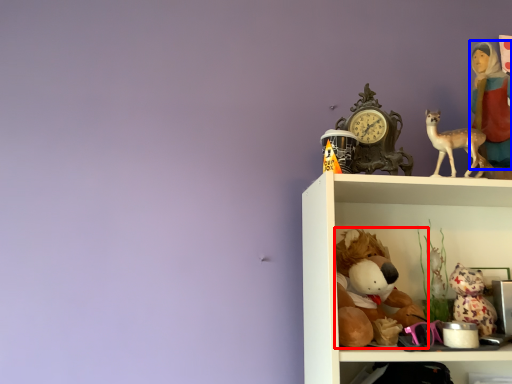
Question: Which object appears farthest to the camera in this image, toy (highlighted by a red box) or person (highlighted by a blue box)?

Choices:
 (A) toy
 (B) person

Answer: (B)